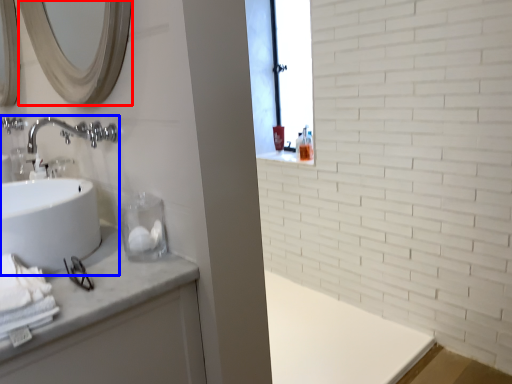
Question: Among these objects, which one is nearest to the camera, mirror (highlighted by a red box) or sink (highlighted by a blue box)?

Choices:
 (A) mirror
 (B) sink

Answer: (A)